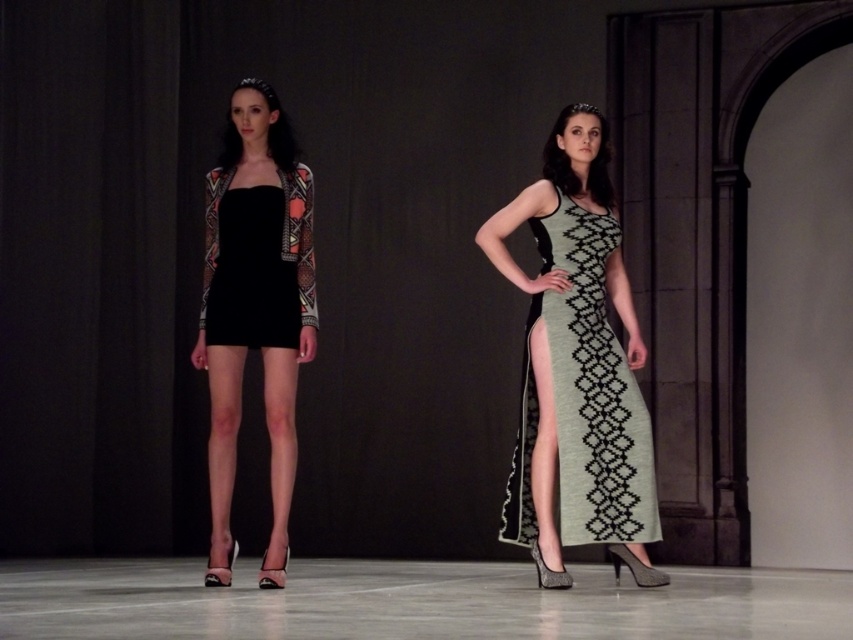
Based on the scene description, where is the matte black dress at center located in terms of its 2D coordinates?

The matte black dress at center is located at the 2D coordinates point (254, 308).

You are a fashion designer observing the runway show and need to ensure that the two dresses at the center of the image are spaced appropriately for a photoshoot. The minimum required distance between them is 1.5 meters. Based on the scene, can you confirm if the green textured dress at center and the black matte dress at center meet this requirement?

The green textured dress at center and black matte dress at center are 1.63 meters apart, which exceeds the minimum required distance of 1.5 meters. Therefore, they meet the spacing requirement for the photoshoot.